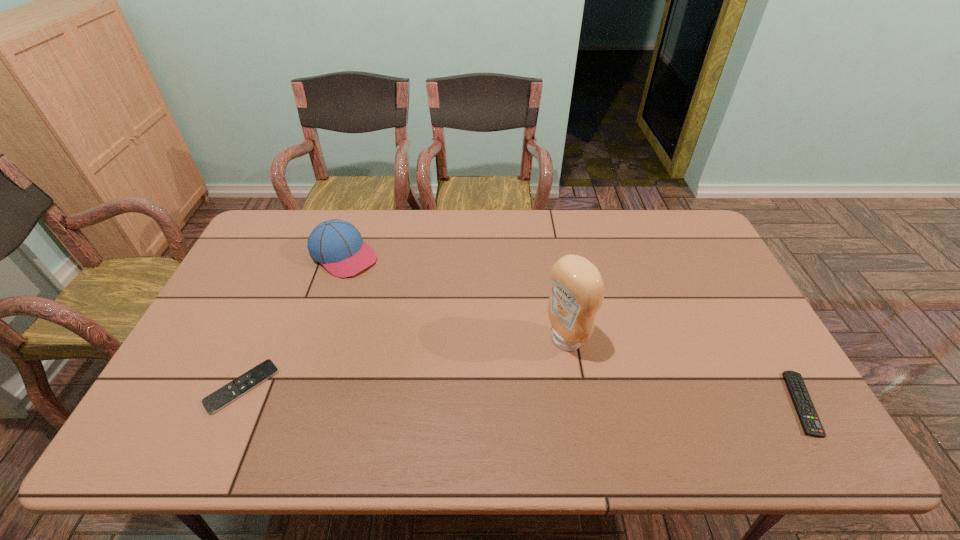
The image size is (960, 540). I want to click on the left remote control, so click(222, 397).

Where is `the shortest object`? Image resolution: width=960 pixels, height=540 pixels. the shortest object is located at coordinates (222, 397).

Find the location of `the right remote control`. the right remote control is located at coordinates click(x=807, y=414).

Find the location of a particular element. Image resolution: width=960 pixels, height=540 pixels. the rightmost object is located at coordinates pyautogui.click(x=807, y=414).

In order to click on the farthest object in this screenshot , I will do `click(336, 244)`.

Locate an element on the screen. The height and width of the screenshot is (540, 960). baseball cap is located at coordinates (336, 244).

Locate an element on the screen. the second object from right to left is located at coordinates (577, 289).

This screenshot has width=960, height=540. Identify the location of condiment. (577, 289).

This screenshot has height=540, width=960. I want to click on vacant space situated on the right of the shortest object, so pyautogui.click(x=364, y=387).

Locate an element on the screen. free space located 0.240m on the back of the right remote control is located at coordinates (744, 305).